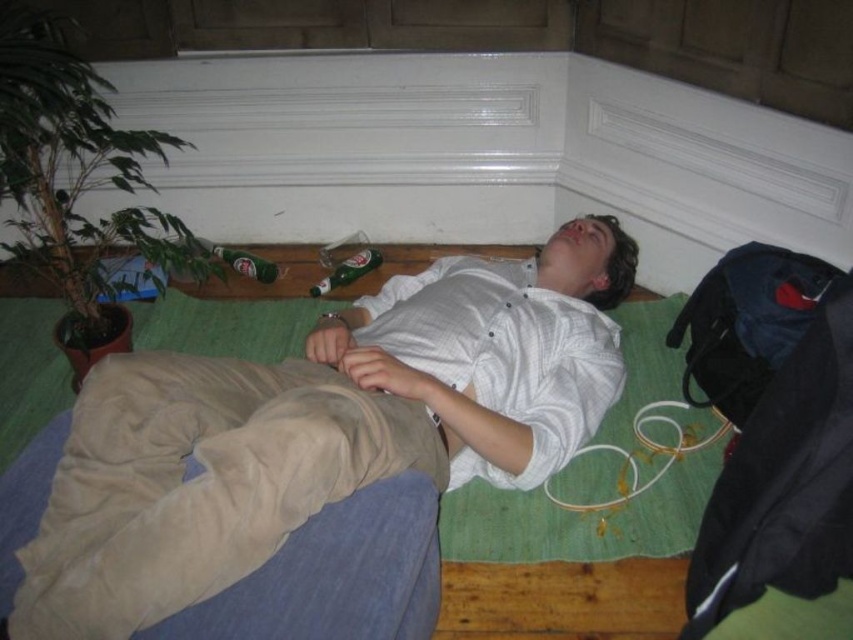
Can you confirm if green glass bottle at lower center is wider than green glass bottle at center?

No.

What do you see at coordinates (347, 269) in the screenshot? The width and height of the screenshot is (853, 640). I see `green glass bottle at lower center` at bounding box center [347, 269].

Image resolution: width=853 pixels, height=640 pixels. Find the location of `green glass bottle at lower center`. green glass bottle at lower center is located at coordinates (347, 269).

Does white cotton shirt at center come in front of green glass bottle at lower center?

Yes, it is.

Image resolution: width=853 pixels, height=640 pixels. I want to click on white cotton shirt at center, so click(x=320, y=428).

You are a GUI agent. You are given a task and a screenshot of the screen. Output one action in this format:
    pyautogui.click(x=<x>, y=<y>)
    Task: Click on the white cotton shirt at center
    This screenshot has width=853, height=640.
    Given the screenshot: What is the action you would take?
    pyautogui.click(x=320, y=428)

Which is below, white cotton shirt at center or green glass bottle at center?

white cotton shirt at center

Between white cotton shirt at center and green glass bottle at center, which one appears on the right side from the viewer's perspective?

white cotton shirt at center

The height and width of the screenshot is (640, 853). I want to click on white cotton shirt at center, so click(x=320, y=428).